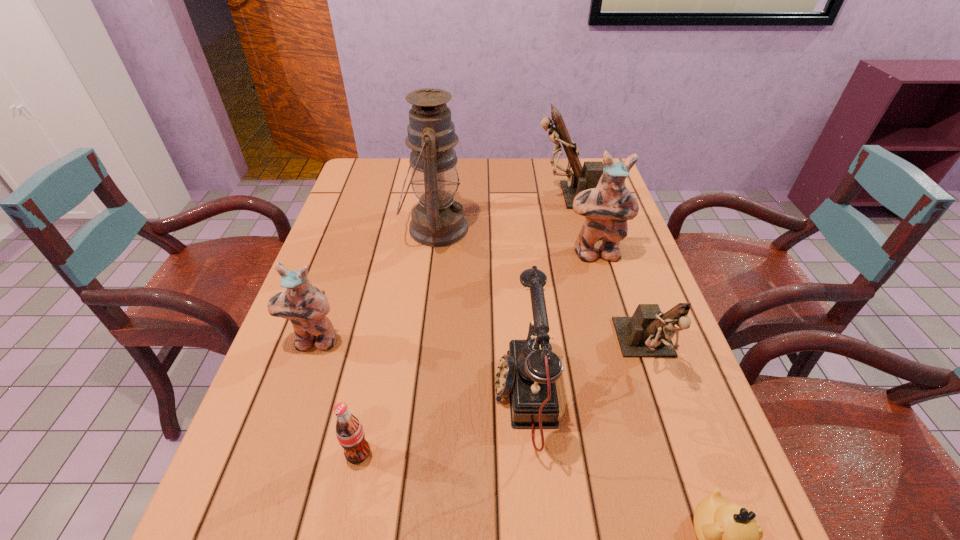
The image size is (960, 540). I want to click on the nearer brown figurine, so click(648, 333).

Identify the location of the second shortest object. (349, 431).

This screenshot has height=540, width=960. I want to click on free region located on the front of the brown oil lamp, so click(425, 306).

The image size is (960, 540). In order to click on blank space located on the front-facing side of the farther brown figurine in this screenshot , I will do `click(484, 195)`.

You are a GUI agent. You are given a task and a screenshot of the screen. Output one action in this format:
    pyautogui.click(x=<x>, y=<y>)
    Task: Click on the free region located 0.360m on the front-facing side of the farther brown figurine
    The height and width of the screenshot is (540, 960).
    Given the screenshot: What is the action you would take?
    pyautogui.click(x=422, y=195)

I want to click on vacant space located on the front-facing side of the farther brown figurine, so click(x=416, y=195).

Locate an element on the screen. free space located 0.270m on the front-facing side of the second farthest figurine is located at coordinates (622, 346).

Find the location of a particular element. The width and height of the screenshot is (960, 540). free region located on the dial of the black telephone is located at coordinates (405, 397).

Image resolution: width=960 pixels, height=540 pixels. I want to click on free spot located on the dial of the black telephone, so click(445, 397).

Locate an element on the screen. free space located 0.400m on the dial of the black telephone is located at coordinates (296, 397).